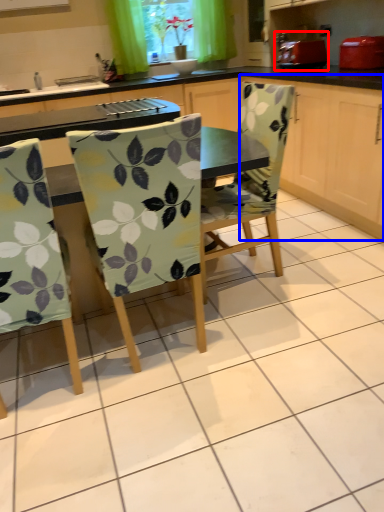
Question: Among these objects, which one is farthest to the camera, appliance (highlighted by a red box) or cabinetry (highlighted by a blue box)?

Choices:
 (A) appliance
 (B) cabinetry

Answer: (A)